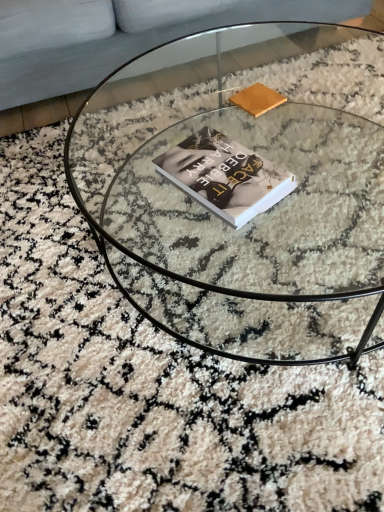
Identify the location of free space that is to the left of matte brown book at upper center. (205, 123).